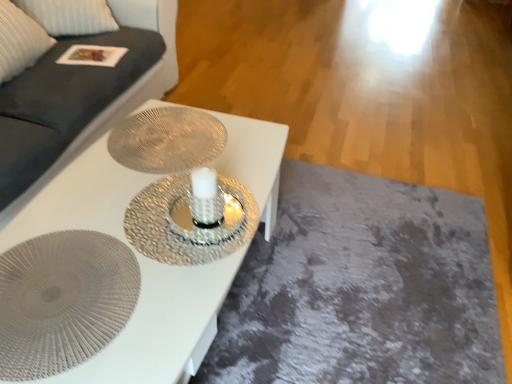
What is the approximate width of dark gray fabric couch at upper left?

dark gray fabric couch at upper left is 3.32 feet in width.

Describe the element at coordinates (160, 324) in the screenshot. The width and height of the screenshot is (512, 384). I see `white textured table at center` at that location.

I want to click on dark gray fabric couch at upper left, so click(74, 80).

Considering the relative sizes of dark gray fabric couch at upper left and white textured table at center in the image provided, is dark gray fabric couch at upper left shorter than white textured table at center?

In fact, dark gray fabric couch at upper left may be taller than white textured table at center.

How many degrees apart are the facing directions of dark gray fabric couch at upper left and white textured table at center?

The facing directions of dark gray fabric couch at upper left and white textured table at center are 1.16 degrees apart.

Consider the image. From the image's perspective, is dark gray fabric couch at upper left above white textured table at center?

Yes.

Is metallic textured plate at center, the 2th oval when ordered from front to back, wider than textured silver plate at center, the 1th oval when ordered from bottom to top?

In fact, metallic textured plate at center, the 2th oval when ordered from front to back, might be narrower than textured silver plate at center, the 1th oval when ordered from bottom to top.

Consider the image. Is metallic textured plate at center, marked as the 1th oval in a top-to-bottom arrangement, oriented towards textured silver plate at center, positioned as the first oval in front-to-back order?

No, metallic textured plate at center, marked as the 1th oval in a top-to-bottom arrangement, is not facing towards textured silver plate at center, positioned as the first oval in front-to-back order.

Considering their positions, is metallic textured plate at center, marked as the 1th oval in a top-to-bottom arrangement, located in front of or behind textured silver plate at center, which is counted as the second oval, starting from the back?

Clearly, metallic textured plate at center, marked as the 1th oval in a top-to-bottom arrangement, is behind textured silver plate at center, which is counted as the second oval, starting from the back.

Does dark gray fabric couch at upper left touch textured silver plate at center, which is the 2th oval in top-to-bottom order?

dark gray fabric couch at upper left and textured silver plate at center, which is the 2th oval in top-to-bottom order, are clearly separated.

From the image's perspective, is dark gray fabric couch at upper left under textured silver plate at center, which is the 2th oval in top-to-bottom order?

Actually, dark gray fabric couch at upper left appears above textured silver plate at center, which is the 2th oval in top-to-bottom order, in the image.

Is dark gray fabric couch at upper left completely or partially outside of textured silver plate at center, which is the 2th oval in top-to-bottom order?

Indeed, dark gray fabric couch at upper left is completely outside textured silver plate at center, which is the 2th oval in top-to-bottom order.

Can you confirm if metallic textured plate at center, positioned as the 2th oval in bottom-to-top order, is positioned to the right of white textured table at center?

Yes, metallic textured plate at center, positioned as the 2th oval in bottom-to-top order, is to the right of white textured table at center.

Can you see metallic textured plate at center, positioned as the 2th oval in bottom-to-top order, touching white textured table at center?

No, metallic textured plate at center, positioned as the 2th oval in bottom-to-top order, is not touching white textured table at center.

Between point (174, 118) and point (93, 181), which one is positioned behind?

The point (174, 118) is behind.

Is dark gray fabric couch at upper left inside textured silver plate at center, positioned as the first oval in front-to-back order?

No, dark gray fabric couch at upper left is not inside textured silver plate at center, positioned as the first oval in front-to-back order.

Is textured silver plate at center, positioned as the first oval in front-to-back order, smaller than dark gray fabric couch at upper left?

Correct, textured silver plate at center, positioned as the first oval in front-to-back order, occupies less space than dark gray fabric couch at upper left.

Is textured silver plate at center, which is counted as the second oval, starting from the back, turned away from dark gray fabric couch at upper left?

No, textured silver plate at center, which is counted as the second oval, starting from the back,'s orientation is not away from dark gray fabric couch at upper left.

From a real-world perspective, is white textured table at center above or below dark gray fabric couch at upper left?

white textured table at center is situated lower than dark gray fabric couch at upper left in the real world.

Could you tell me if white textured table at center is turned towards dark gray fabric couch at upper left?

No, white textured table at center is not aimed at dark gray fabric couch at upper left.

Considering the relative sizes of white textured table at center and dark gray fabric couch at upper left in the image provided, is white textured table at center taller than dark gray fabric couch at upper left?

No, white textured table at center is not taller than dark gray fabric couch at upper left.

Which is in front, point (160, 359) or point (64, 138)?

The point (160, 359) is closer to the camera.

Is textured silver plate at center, the 1th oval when ordered from bottom to top, looking in the opposite direction of white textured table at center?

Correct, textured silver plate at center, the 1th oval when ordered from bottom to top, is looking away from white textured table at center.

From the image's perspective, which object appears higher, textured silver plate at center, positioned as the first oval in front-to-back order, or white textured table at center?

white textured table at center appears higher in the image.

Is textured silver plate at center, the 1th oval when ordered from bottom to top, positioned beyond the bounds of white textured table at center?

No, textured silver plate at center, the 1th oval when ordered from bottom to top, is inside or overlapping with white textured table at center.

Considering the relative sizes of textured silver plate at center, positioned as the first oval in front-to-back order, and white textured table at center in the image provided, is textured silver plate at center, positioned as the first oval in front-to-back order, bigger than white textured table at center?

No.

Locate an element on the screen. couch above the white textured table at center (from the image's perspective) is located at coordinates (74, 80).

You are a GUI agent. You are given a task and a screenshot of the screen. Output one action in this format:
    pyautogui.click(x=<x>, y=<y>)
    Task: Click on the oval on the right of the textured silver plate at center, which is the 2th oval in top-to-bottom order
    
    Given the screenshot: What is the action you would take?
    [x=167, y=140]

From the image, which object appears to be nearer to dark gray fabric couch at upper left, textured silver plate at center, which is counted as the second oval, starting from the back, or metallic textured plate at center, positioned as the 1th oval in back-to-front order?

Based on the image, metallic textured plate at center, positioned as the 1th oval in back-to-front order, appears to be nearer to dark gray fabric couch at upper left.

Based on their spatial positions, is textured silver plate at center, the 1th oval when ordered from bottom to top, or metallic textured plate at center, positioned as the 1th oval in back-to-front order, closer to white textured table at center?

metallic textured plate at center, positioned as the 1th oval in back-to-front order, is closer to white textured table at center.

Which object lies nearer to the anchor point metallic textured plate at center, the 2th oval when ordered from front to back, dark gray fabric couch at upper left or textured silver plate at center, the 1th oval when ordered from bottom to top?

Among the two, textured silver plate at center, the 1th oval when ordered from bottom to top, is located nearer to metallic textured plate at center, the 2th oval when ordered from front to back.

When comparing their distances from dark gray fabric couch at upper left, does metallic textured plate at center, the 2th oval when ordered from front to back, or white textured table at center seem further?

Among the two, white textured table at center is located further to dark gray fabric couch at upper left.

When comparing their distances from dark gray fabric couch at upper left, does white textured table at center or metallic textured plate at center, marked as the 1th oval in a top-to-bottom arrangement, seem closer?

The object closer to dark gray fabric couch at upper left is metallic textured plate at center, marked as the 1th oval in a top-to-bottom arrangement.

Which object lies further to the anchor point white textured table at center, metallic textured plate at center, the 2th oval when ordered from front to back, or textured silver plate at center, positioned as the first oval in front-to-back order?

Among the two, textured silver plate at center, positioned as the first oval in front-to-back order, is located further to white textured table at center.

Looking at the image, which one is located closer to textured silver plate at center, positioned as the first oval in front-to-back order, metallic textured plate at center, the 2th oval when ordered from front to back, or dark gray fabric couch at upper left?

Based on the image, metallic textured plate at center, the 2th oval when ordered from front to back, appears to be nearer to textured silver plate at center, positioned as the first oval in front-to-back order.

Based on their spatial positions, is white textured table at center or dark gray fabric couch at upper left further from textured silver plate at center, which is the 2th oval in top-to-bottom order?

Among the two, dark gray fabric couch at upper left is located further to textured silver plate at center, which is the 2th oval in top-to-bottom order.

You are a GUI agent. You are given a task and a screenshot of the screen. Output one action in this format:
    pyautogui.click(x=<x>, y=<y>)
    Task: Click on the table between dark gray fabric couch at upper left and metallic textured plate at center, positioned as the 2th oval in bottom-to-top order, from left to right
    The image size is (512, 384).
    Given the screenshot: What is the action you would take?
    pyautogui.click(x=160, y=324)

The image size is (512, 384). I want to click on table that lies between dark gray fabric couch at upper left and textured silver plate at center, which is the 2th oval in top-to-bottom order, from top to bottom, so click(160, 324).

What are the coordinates of `oval between dark gray fabric couch at upper left and metallic textured plate at center, positioned as the 2th oval in bottom-to-top order, in the horizontal direction` in the screenshot? It's located at (63, 301).

Where is `oval located between white textured table at center and metallic textured plate at center, positioned as the 1th oval in back-to-front order, in the depth direction`? The image size is (512, 384). oval located between white textured table at center and metallic textured plate at center, positioned as the 1th oval in back-to-front order, in the depth direction is located at coordinates (63, 301).